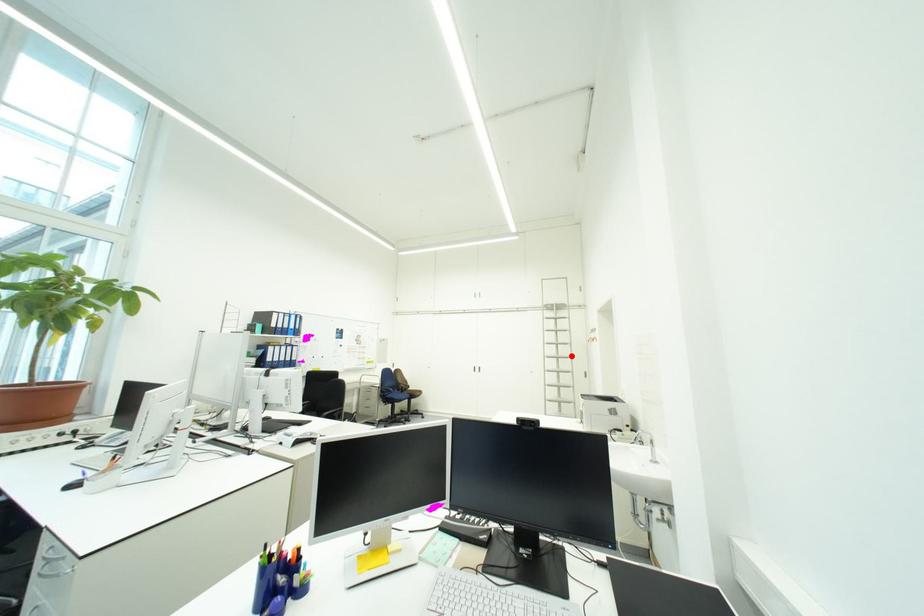
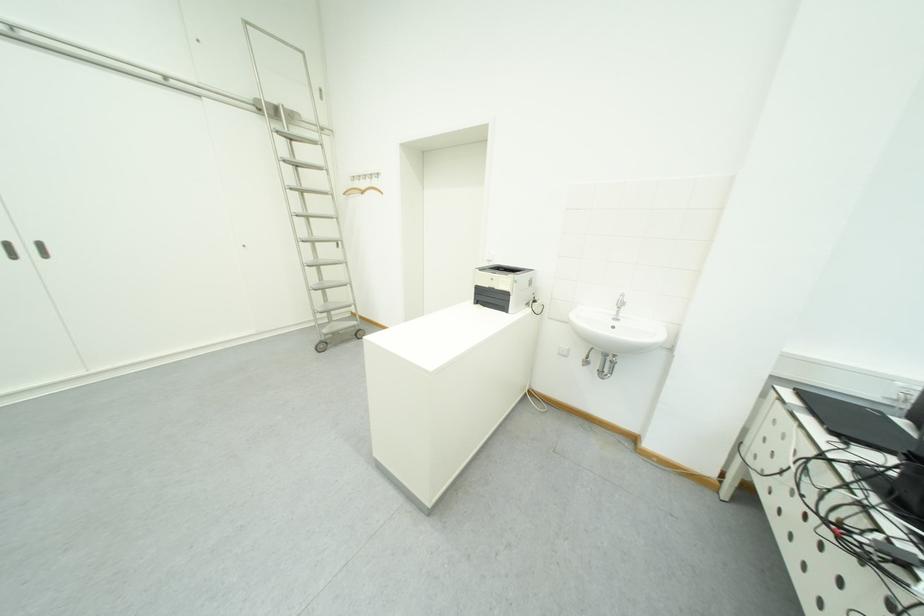
Question: A red point is marked in image1. In image2, is the corresponding 3D point closer to the camera or farther? Reply with the corresponding letter.

Choices:
 (A) The corresponding 3D point is closer.
 (B) The corresponding 3D point is farther.

Answer: (A)